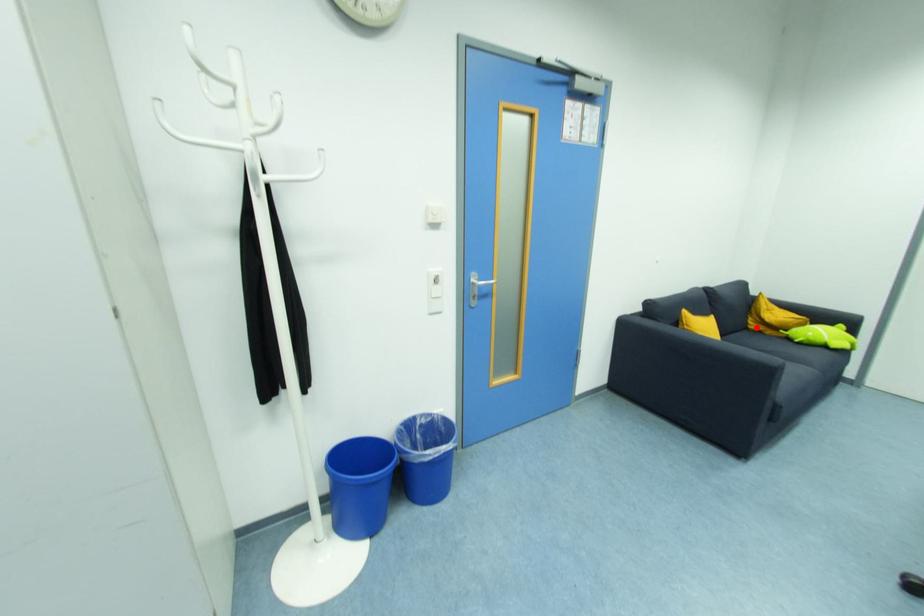
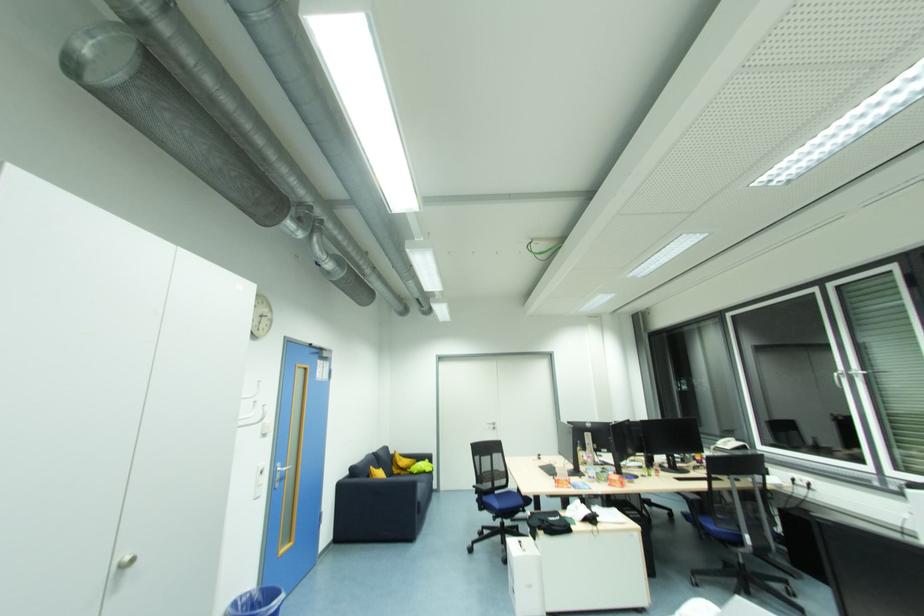
Find the pixel in the second image that matches the highlighted location in the first image.

(398, 472)